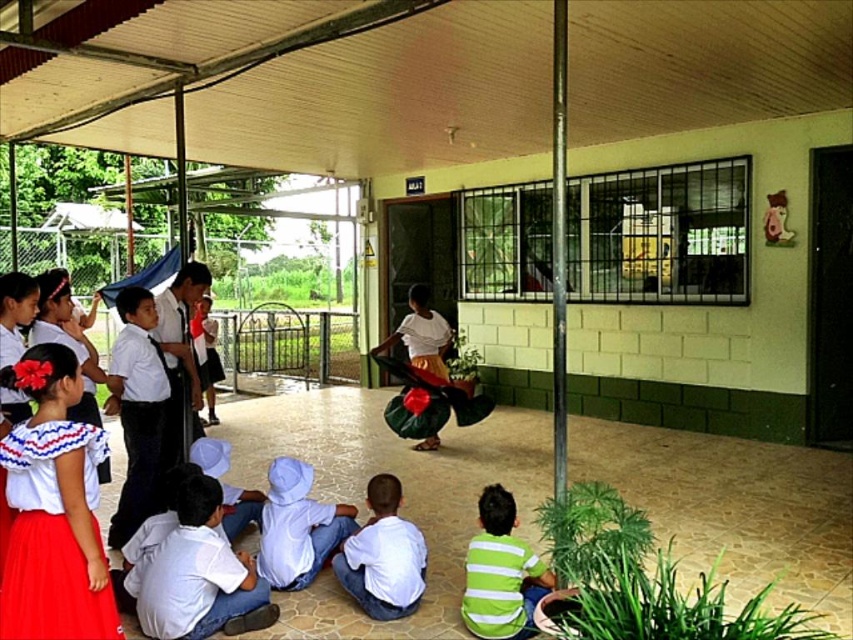
Describe the element at coordinates (190, 570) in the screenshot. The height and width of the screenshot is (640, 853). I see `white cotton shirt at lower left` at that location.

The width and height of the screenshot is (853, 640). Identify the location of white cotton shirt at lower left. (190, 570).

The image size is (853, 640). I want to click on white cotton shirt at lower left, so click(x=190, y=570).

Is wooden ceiling at upper center smaller than white matte shirt at lower center?

Yes, wooden ceiling at upper center is smaller than white matte shirt at lower center.

Is wooden ceiling at upper center positioned in front of white matte shirt at lower center?

No.

Locate an element on the screen. The height and width of the screenshot is (640, 853). wooden ceiling at upper center is located at coordinates (306, 84).

Describe the element at coordinates (306, 84) in the screenshot. This screenshot has height=640, width=853. I see `wooden ceiling at upper center` at that location.

Is wooden ceiling at upper center thinner than matte white blouse at lower left?

No.

Locate an element on the screen. This screenshot has width=853, height=640. wooden ceiling at upper center is located at coordinates (306, 84).